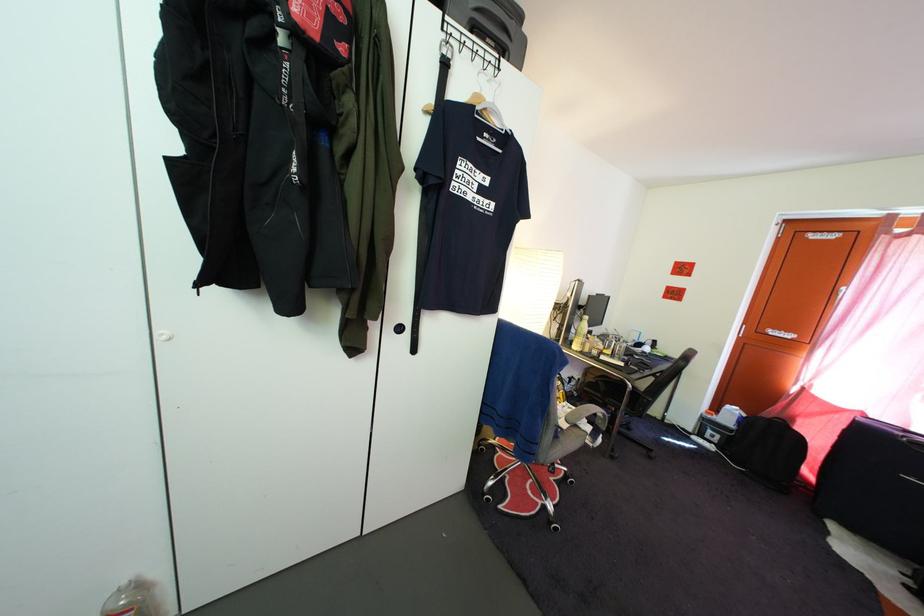
This screenshot has width=924, height=616. In order to click on chair armrest in this screenshot , I will do `click(588, 416)`.